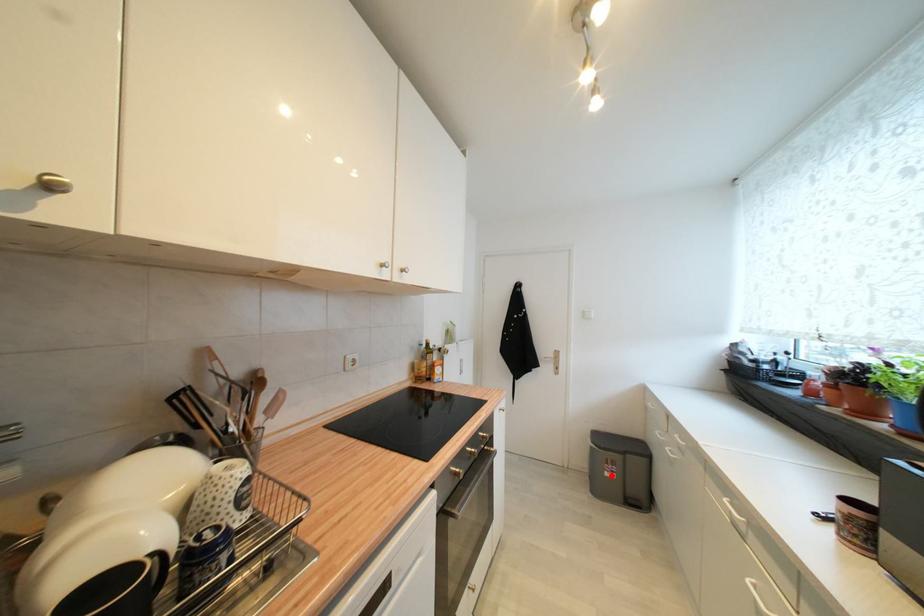
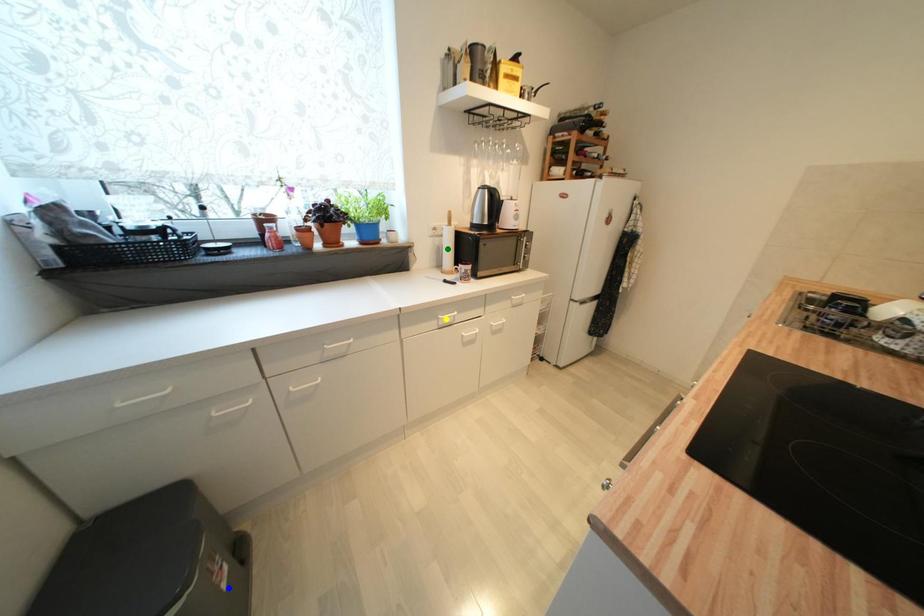
Question: I am providing you with two images of the same scene from different viewpoints. A red point is marked on the first image. You are given multiple points on the second image. Which spot in image 2 lines up with the point in image 1?

Choices:
 (A) yellow point
 (B) blue point
 (C) green point

Answer: (B)